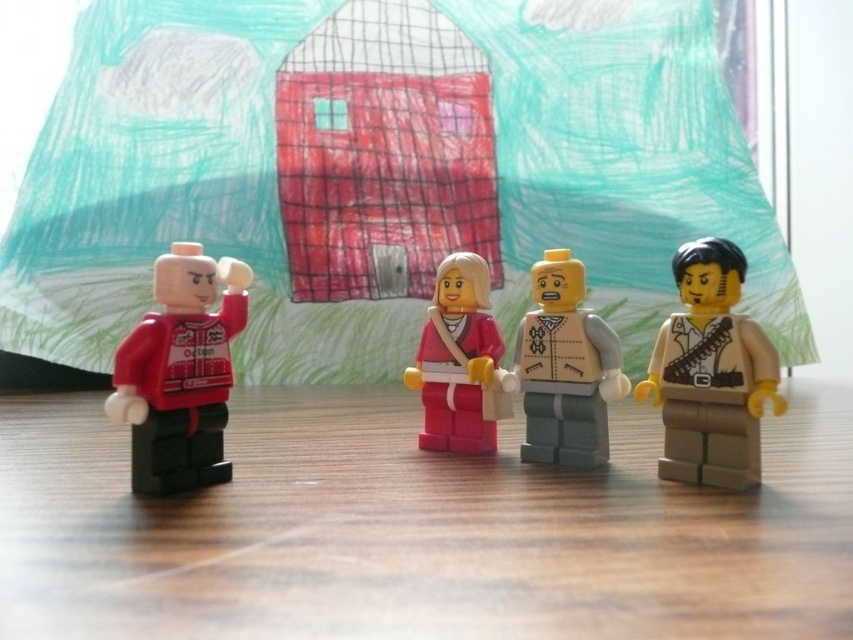
Question: Estimate the real-world distances between objects in this image. Which object is closer to the light gray plastic minifigure at center?

Choices:
 (A) pink matte figure at center
 (B) matte red minifigure at left
 (C) tan matte minifigure at right

Answer: (A)

Question: Is wooden table at lower center thinner than matte red minifigure at left?

Choices:
 (A) yes
 (B) no

Answer: (B)

Question: Can you confirm if wooden table at lower center is wider than tan matte minifigure at right?

Choices:
 (A) no
 (B) yes

Answer: (B)

Question: Which point is farther to the camera?

Choices:
 (A) (100, 488)
 (B) (187, 445)

Answer: (B)

Question: Which object is the closest to the tan matte minifigure at right?

Choices:
 (A) matte red minifigure at left
 (B) wooden table at lower center
 (C) pink matte figure at center

Answer: (C)

Question: Is matte red minifigure at left positioned behind pink matte figure at center?

Choices:
 (A) yes
 (B) no

Answer: (B)